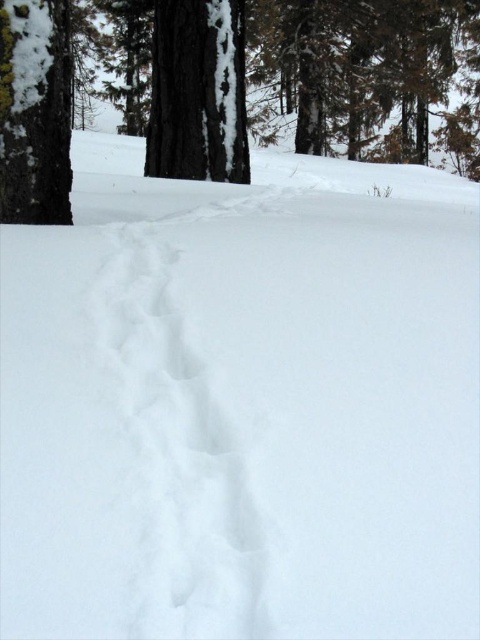
You are an animal tracker in the winter forest. You see the brown rough tree at center and the white fluffy snow trail at center. Which object is larger in size?

The brown rough tree at center is bigger than the white fluffy snow trail at center.

You are a wildlife researcher analyzing the winter scene. You notice the white fluffy snow trail at center. Where exactly is this trail located in the image?

The white fluffy snow trail at center is located at the coordinates point (177, 454).

In the scene shown: You are an animal tracker in the winter forest. You notice the white fluffy snow trail at center and the smooth bark tree at center. Which object is nearer to you?

The white fluffy snow trail at center is closer to the viewer than the smooth bark tree at center.